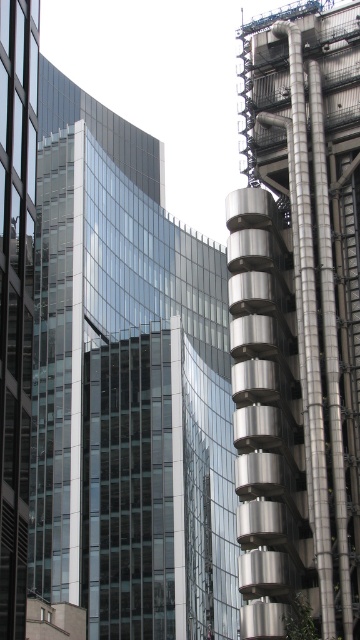
You are standing at the center of the image and want to walk towards the transparent glass building at center. Which direction should you move in relation to the modern glass skyscraper on the left and the cylindrical building on the right?

Answer: The transparent glass building at center is located at point coordinates, so you should move towards it directly from the center. However, based on the scene description, the modern glass skyscraper is on the left and the cylindrical building is on the right. Since the transparent glass building is at the center, you would need to move towards the center, which is between the two buildings. Therefore, adjust your path between the modern glass skyscraper on the left and the cylindrical building on the right.

You are standing at the point marked by coordinates point (x=127, y=388) in the image. Which building are you facing? The modern glass skyscraper on the left or the cylindrical building on the right?

The transparent glass building at center is represented by point (x=127, y=388), so you are facing the transparent glass building at center.